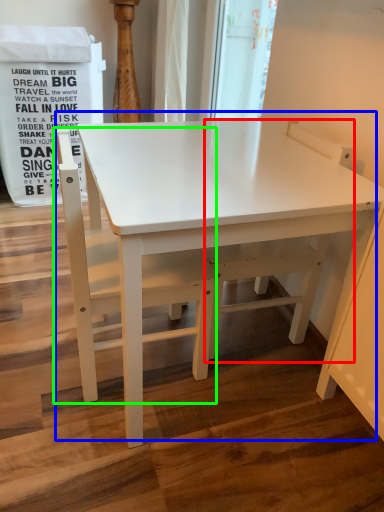
Question: Which object is positioned closest to swivel chair (highlighted by a red box)? Select from table (highlighted by a blue box) and chair (highlighted by a green box).

Choices:
 (A) table
 (B) chair

Answer: (A)